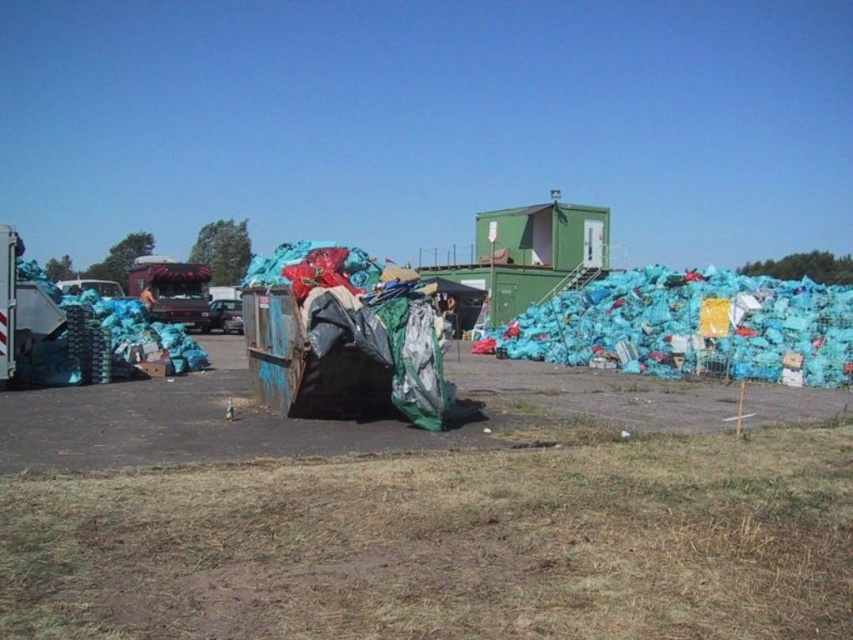
You are a worker at the recycling facility and need to determine if the blue plastic bags at left can be placed on top of the brushed metal garbage truck at left without exceeding its height. Based on the scene description, can you confirm if this is possible?

The blue plastic bags at left is shorter than the brushed metal garbage truck at left, so placing them on top would not exceed the truck height.

You are a delivery driver who needs to park your car between the brown dry grass at center and the brushed metal garbage truck at left. Is there enough space to park your car there?

The brown dry grass at center is positioned on the right side of brushed metal garbage truck at left, so there is no space between them to park your car.